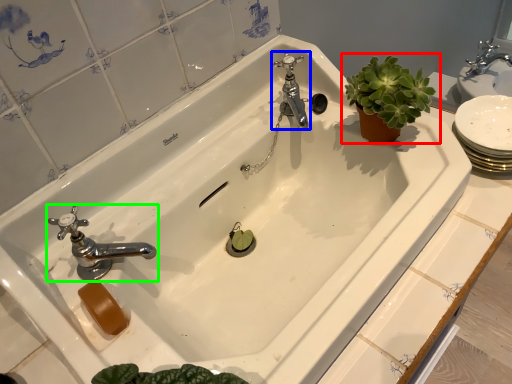
Question: Based on their relative distances, which object is nearer to houseplant (highlighted by a red box)? Choose from tap (highlighted by a blue box) and tap (highlighted by a green box).

Choices:
 (A) tap
 (B) tap

Answer: (A)